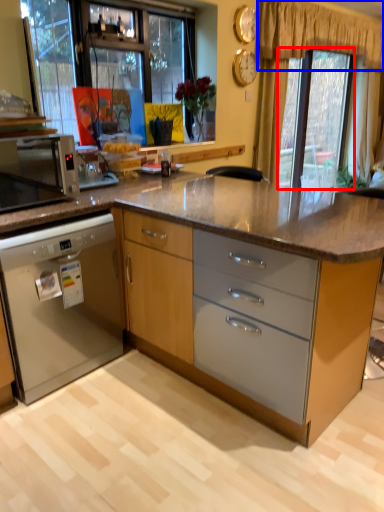
Question: Among these objects, which one is nearest to the camera, window screen (highlighted by a red box) or curtain (highlighted by a blue box)?

Choices:
 (A) window screen
 (B) curtain

Answer: (B)